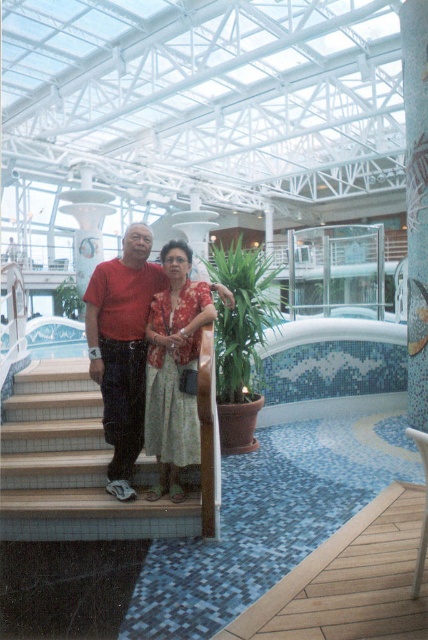
You are designing a layout for a new indoor pool area and want to ensure there is enough space between the blue mosaic tile pool at center and the green leafy plant at upper center. Based on the scene provided, which object occupies more horizontal space?

The blue mosaic tile pool at center has a larger width than the green leafy plant at upper center, so it occupies more horizontal space.

Consider the image. You are a photographer trying to capture a clear shot of the matte red shirt at center and the green leafy plant at upper center. Since both are in the frame, which object would you focus on first if you want to ensure the thinner object is in sharp focus?

The matte red shirt at center is thinner than the green leafy plant at upper center, so you should focus on the matte red shirt at center first to ensure its sharpness.

You are standing at the entrance of the staircase and want to find the matte red shirt at center. According to the coordinates provided, in which direction should you look to locate it?

The matte red shirt at center is located at point coordinates, so you should look towards the center area where the coordinates indicate its position.